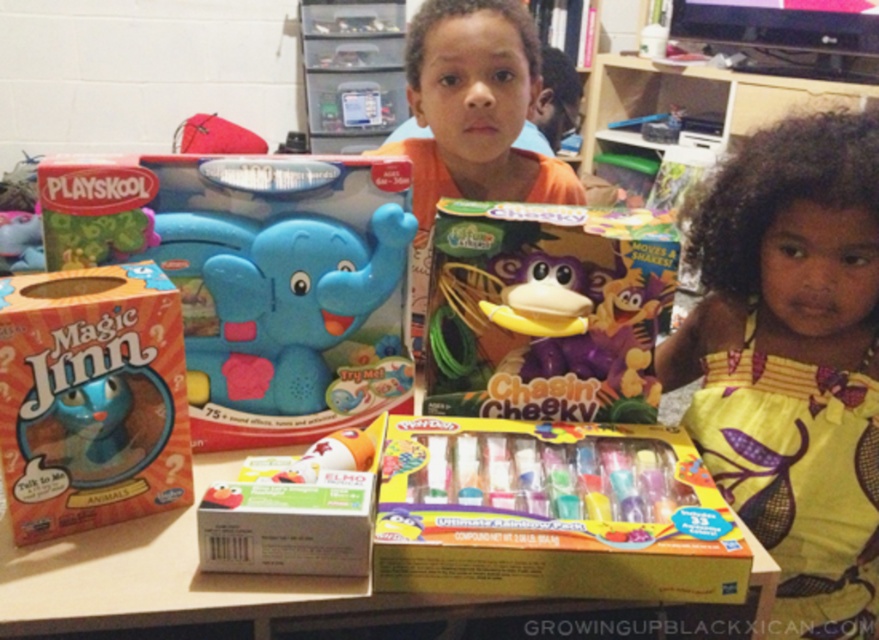
Question: Which of the following is the farthest from the observer?

Choices:
 (A) (309, 273)
 (B) (765, 289)
 (C) (456, 278)
 (D) (33, 337)

Answer: (B)

Question: Is yellow printed fabric at right bigger than orange matte shirt at center?

Choices:
 (A) no
 (B) yes

Answer: (A)

Question: Does matte plastic play-doh at center appear under purple matte toy at center?

Choices:
 (A) yes
 (B) no

Answer: (A)

Question: Is orange matte magic jinn box at lower left positioned in front of orange matte shirt at center?

Choices:
 (A) no
 (B) yes

Answer: (B)

Question: Which object is closer to the camera taking this photo?

Choices:
 (A) orange matte shirt at center
 (B) yellow printed fabric at right

Answer: (A)

Question: Which of the following is the farthest from the observer?

Choices:
 (A) yellow printed fabric at right
 (B) yellow cardboard box at center
 (C) purple matte toy at center
 (D) orange matte shirt at center

Answer: (A)